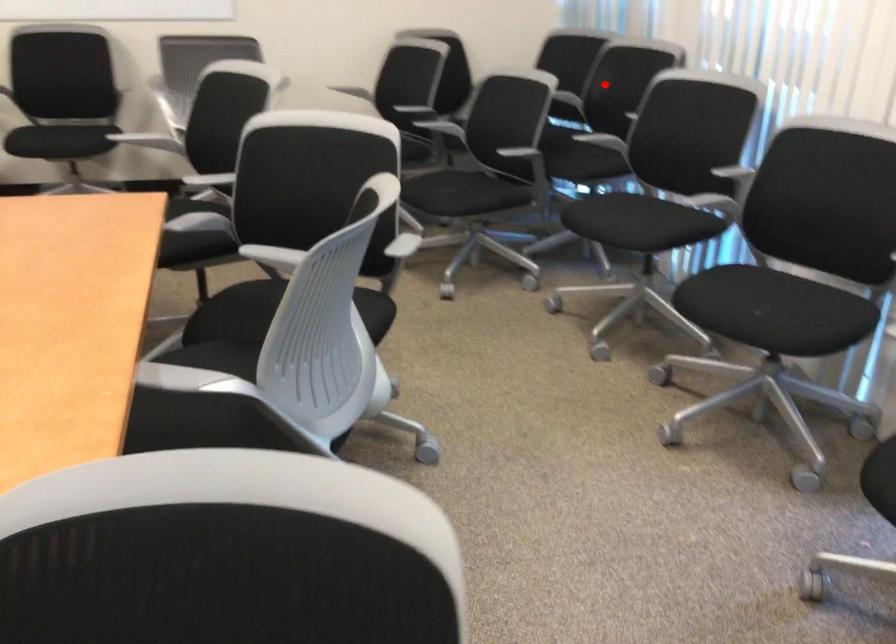
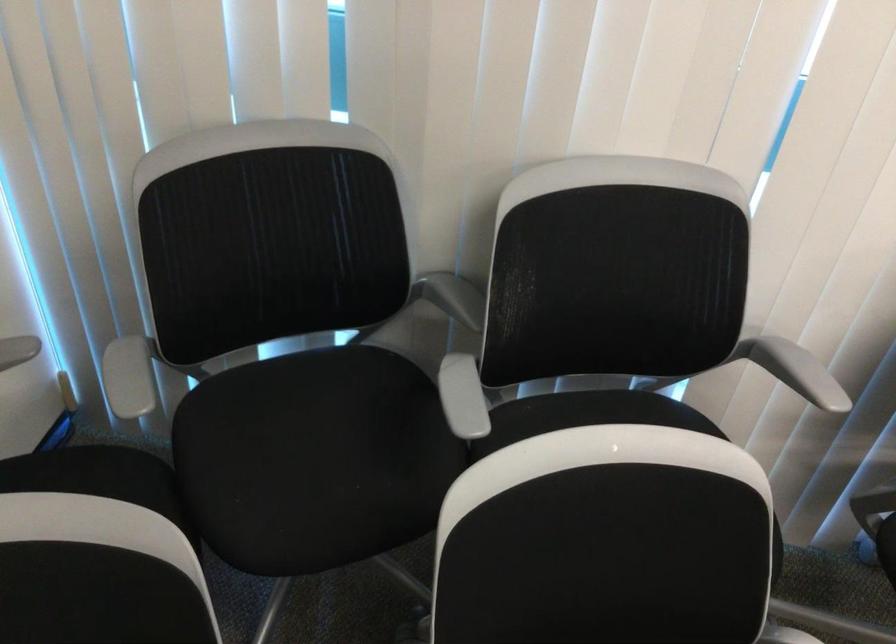
Question: I am providing you with two images of the same scene from different viewpoints. A red point is shown in image1. For the corresponding object point in image2, is it positioned nearer or farther from the camera?

Choices:
 (A) Nearer
 (B) Farther

Answer: (A)